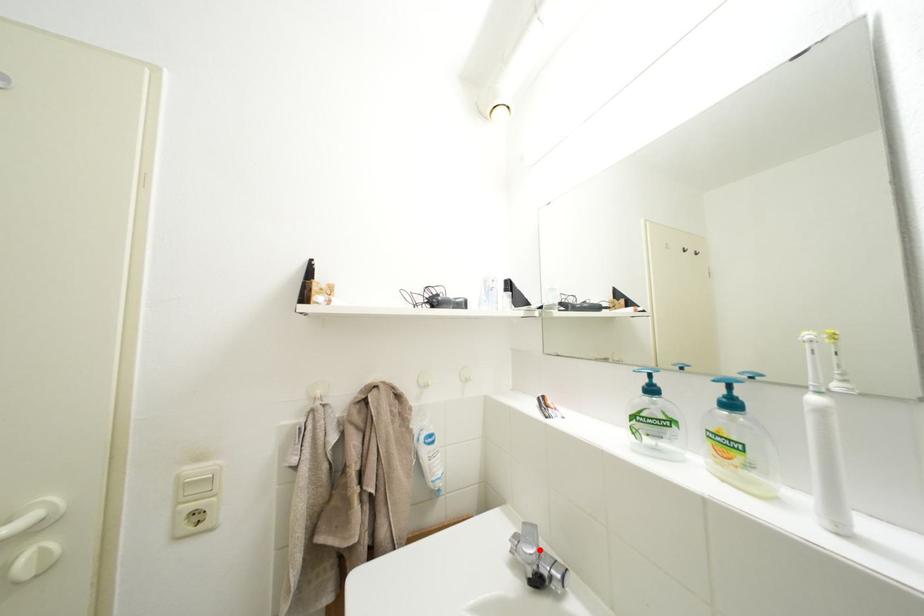
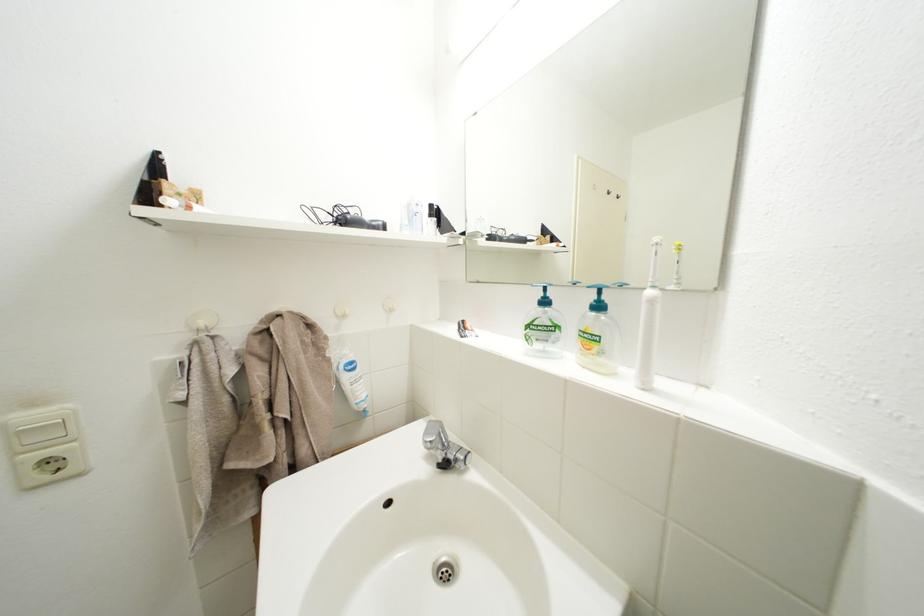
The point at the highlighted location is marked in the first image. Where is the corresponding point in the second image?

(441, 440)